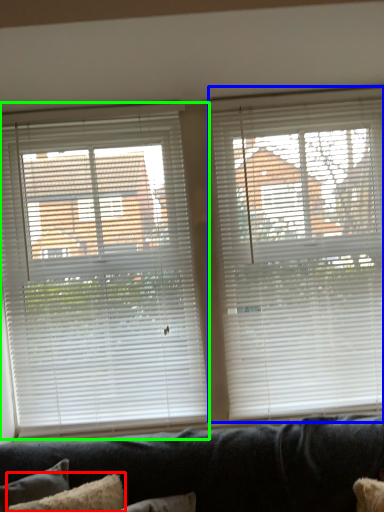
Question: Estimate the real-world distances between objects in this image. Which object is closer to pillow (highlighted by a red box), window blind (highlighted by a blue box) or window blind (highlighted by a green box)?

Choices:
 (A) window blind
 (B) window blind

Answer: (B)